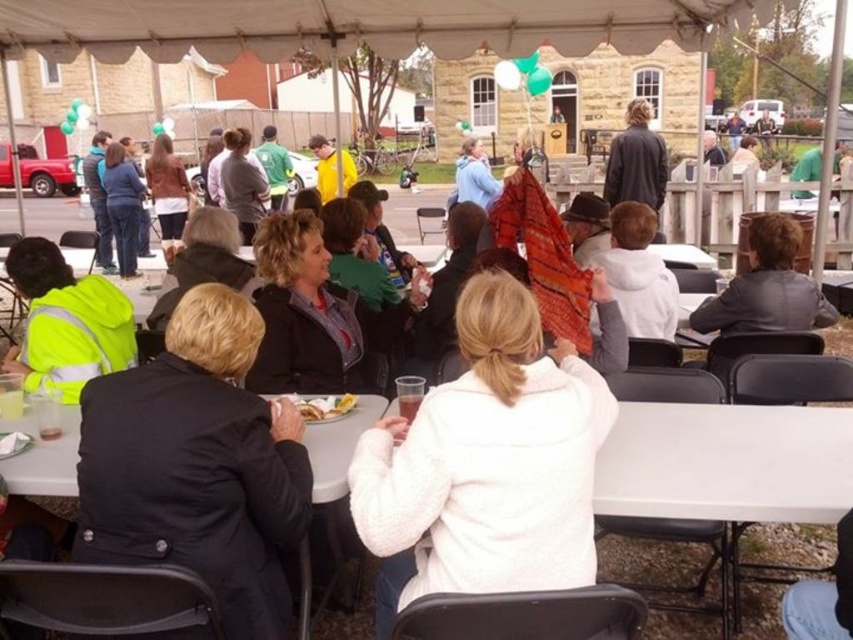
Does white plastic table at center have a greater height compared to high visibility yellow jacket at lower left?

No, white plastic table at center is not taller than high visibility yellow jacket at lower left.

Locate an element on the screen. This screenshot has width=853, height=640. white plastic table at center is located at coordinates (727, 461).

Can you confirm if white fleece jacket at center is bigger than yellow fabric jacket at center?

No, white fleece jacket at center is not bigger than yellow fabric jacket at center.

Who is lower down, white fleece jacket at center or yellow fabric jacket at center?

white fleece jacket at center is below.

Who is more distant from viewer, (x=599, y=410) or (x=335, y=172)?

The point (x=335, y=172) is more distant.

This screenshot has height=640, width=853. In order to click on white fleece jacket at center in this screenshot , I will do `click(489, 460)`.

Between white plastic table at lower center and yellow fabric jacket at center, which one has less height?

With less height is white plastic table at lower center.

Is point (341, 476) closer to camera compared to point (345, 170)?

Yes, it is in front of point (345, 170).

At what (x,y) coordinates should I click in order to perform the action: click on white plastic table at lower center. Please return your answer as a coordinate pair (x, y). Looking at the image, I should click on (338, 445).